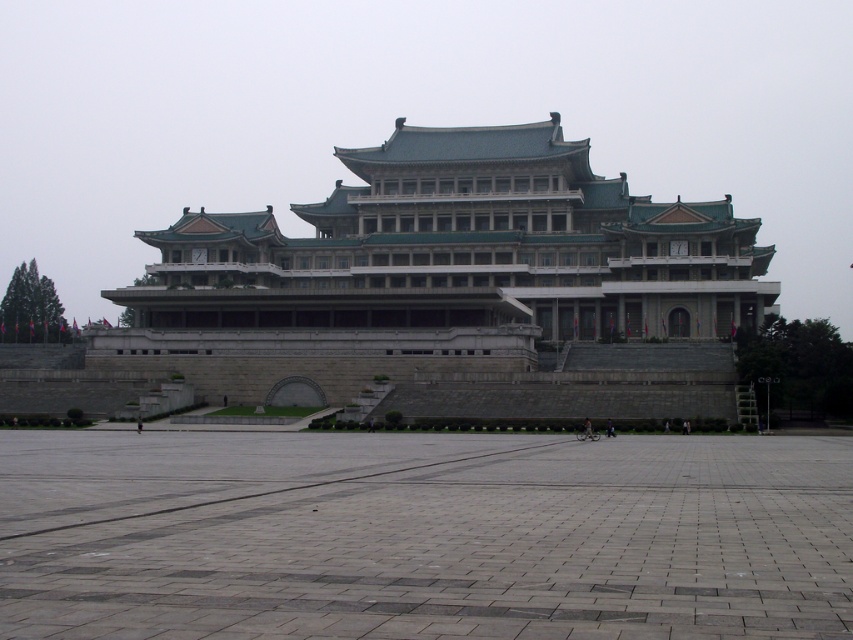
Can you confirm if gray concrete plaza at center is bigger than gray stone palace at center?

Actually, gray concrete plaza at center might be smaller than gray stone palace at center.

Which is in front, point (300, 518) or point (604, 396)?

Point (300, 518) is more forward.

Which is behind, point (308, 529) or point (347, 360)?

Point (347, 360)

This screenshot has width=853, height=640. I want to click on gray concrete plaza at center, so click(422, 536).